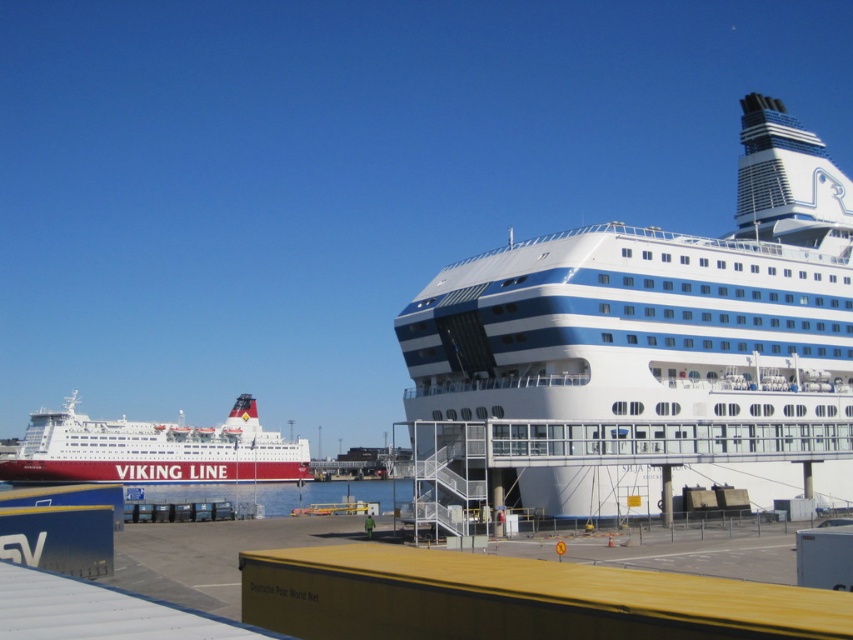
You are a port authority official checking the height restrictions for the new bridge under construction. The bridge has a maximum clearance height of 50 meters. You observe the white glossy cruise ship at right and the white glossy ferry at left in the port. Which vessel exceeds the bridge height limit?

The white glossy cruise ship at right is taller than the white glossy ferry at left. Since the bridge has a maximum clearance of 50 meters, we need to determine which vessel exceeds this limit. However, the exact heights of both vessels are not provided in the scene description. Therefore, it is impossible to definitively conclude which vessel exceeds the bridge height limit based on the given information.

You are a port authority official observing the port scene. You notice two ships, the white glossy cruise ship at right and the white glossy ferry at left. Which one appears closer to the viewer based on their positions in the image?

The white glossy cruise ship at right appears closer to the viewer because it is positioned in front of the white glossy ferry at left, partially obscuring it from view.

You are a dock worker who needs to guide a new ship to dock. The new ship is wider than the white glossy ferry at left. Based on the scene, can the new ship dock in the same spot as the white glossy cruise ship at right?

The white glossy cruise ship at right is thinner than the white glossy ferry at left. Since the new ship is wider than the white glossy ferry at left, it cannot fit in the same spot as the white glossy cruise ship at right because the space there is narrower.